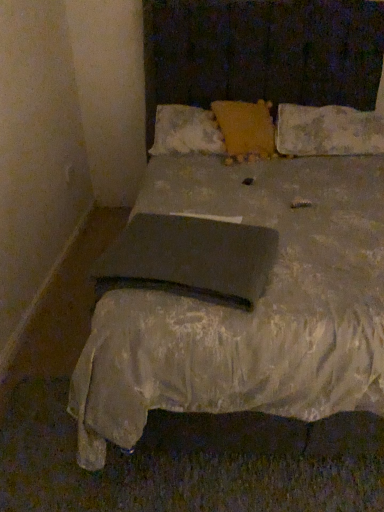
Question: From the image's perspective, would you say fluffy yellow pillow at center, the second pillow viewed from the left, is shown under matte black pad at center?

Choices:
 (A) yes
 (B) no

Answer: (B)

Question: Is fluffy yellow pillow at center, the second pillow viewed from the left, not near matte black pad at center?

Choices:
 (A) no
 (B) yes

Answer: (B)

Question: Does fluffy yellow pillow at center, positioned as the second pillow in right-to-left order, appear on the right side of matte black pad at center?

Choices:
 (A) no
 (B) yes

Answer: (B)

Question: From a real-world perspective, does fluffy yellow pillow at center, positioned as the second pillow in right-to-left order, stand above matte black pad at center?

Choices:
 (A) yes
 (B) no

Answer: (A)

Question: Can you confirm if fluffy yellow pillow at center, the second pillow viewed from the left, is shorter than matte black pad at center?

Choices:
 (A) yes
 (B) no

Answer: (B)

Question: From their relative heights in the image, would you say matte black pad at center is taller or shorter than yellow textured pillow at center, which appears as the third pillow when viewed from the right?

Choices:
 (A) short
 (B) tall

Answer: (A)

Question: Is point (246, 292) positioned closer to the camera than point (190, 142)?

Choices:
 (A) closer
 (B) farther

Answer: (A)

Question: Visually, is matte black pad at center positioned to the left or to the right of yellow textured pillow at center, the first pillow viewed from the left?

Choices:
 (A) right
 (B) left

Answer: (B)

Question: Which is correct: matte black pad at center is inside yellow textured pillow at center, the first pillow viewed from the left, or outside of it?

Choices:
 (A) inside
 (B) outside

Answer: (B)

Question: In terms of width, does worn fabric pillow at upper right, positioned as the third pillow in left-to-right order, look wider or thinner when compared to yellow textured pillow at center, the first pillow viewed from the left?

Choices:
 (A) wide
 (B) thin

Answer: (A)

Question: Is worn fabric pillow at upper right, positioned as the 1th pillow in right-to-left order, in front of or behind yellow textured pillow at center, which appears as the third pillow when viewed from the right, in the image?

Choices:
 (A) behind
 (B) front

Answer: (B)

Question: From a real-world perspective, is worn fabric pillow at upper right, positioned as the third pillow in left-to-right order, physically located above or below yellow textured pillow at center, which appears as the third pillow when viewed from the right?

Choices:
 (A) below
 (B) above

Answer: (A)

Question: From the image's perspective, is worn fabric pillow at upper right, positioned as the third pillow in left-to-right order, positioned above or below yellow textured pillow at center, the first pillow viewed from the left?

Choices:
 (A) below
 (B) above

Answer: (A)

Question: Does point (160, 113) appear closer or farther from the camera than point (150, 237)?

Choices:
 (A) farther
 (B) closer

Answer: (A)

Question: From a real-world perspective, is yellow textured pillow at center, which appears as the third pillow when viewed from the right, above or below matte black pad at center?

Choices:
 (A) below
 (B) above

Answer: (B)